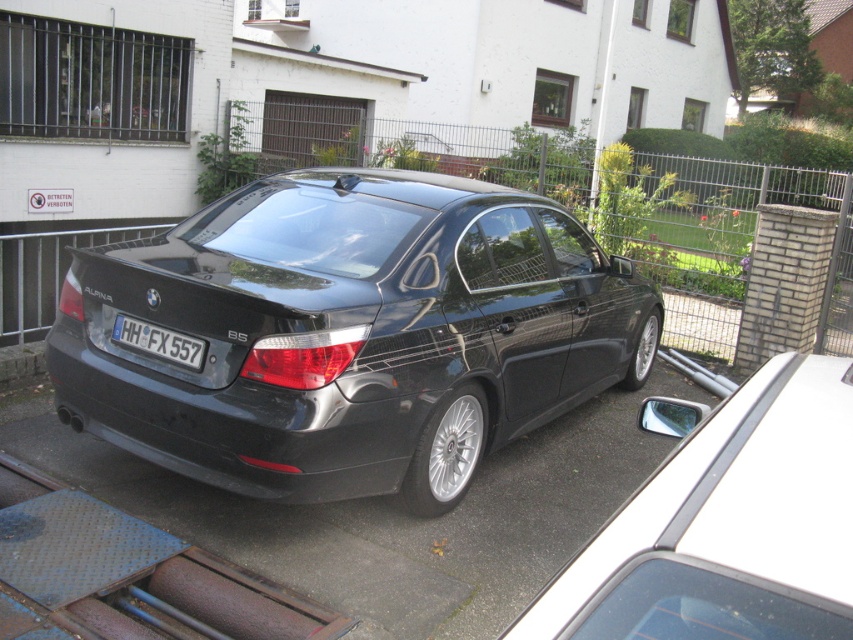
The height and width of the screenshot is (640, 853). Describe the element at coordinates (350, 333) in the screenshot. I see `glossy black car at center` at that location.

Who is higher up, glossy black car at center or black asphalt driveway at center?

Positioned higher is glossy black car at center.

Describe the element at coordinates (350, 333) in the screenshot. I see `glossy black car at center` at that location.

Where is `glossy black car at center`? The height and width of the screenshot is (640, 853). glossy black car at center is located at coordinates (350, 333).

At what (x,y) coordinates should I click in order to perform the action: click on black asphalt driveway at center. Please return your answer as a coordinate pair (x, y). Image resolution: width=853 pixels, height=640 pixels. Looking at the image, I should click on (387, 515).

Is black asphalt driveway at center shorter than white plastic license plate at center?

Incorrect, black asphalt driveway at center's height does not fall short of white plastic license plate at center's.

Is point (456, 634) positioned behind point (170, 348)?

No, (456, 634) is in front of (170, 348).

Where is `black asphalt driveway at center`? This screenshot has width=853, height=640. black asphalt driveway at center is located at coordinates (387, 515).

Between black asphalt driveway at center and glossy black sedan at center, which one has less height?

glossy black sedan at center is shorter.

Can you confirm if black asphalt driveway at center is shorter than glossy black sedan at center?

Incorrect, black asphalt driveway at center's height does not fall short of glossy black sedan at center's.

Between point (187, 538) and point (786, 426), which one is positioned in front?

Point (786, 426)

Locate an element on the screen. Image resolution: width=853 pixels, height=640 pixels. black asphalt driveway at center is located at coordinates (387, 515).